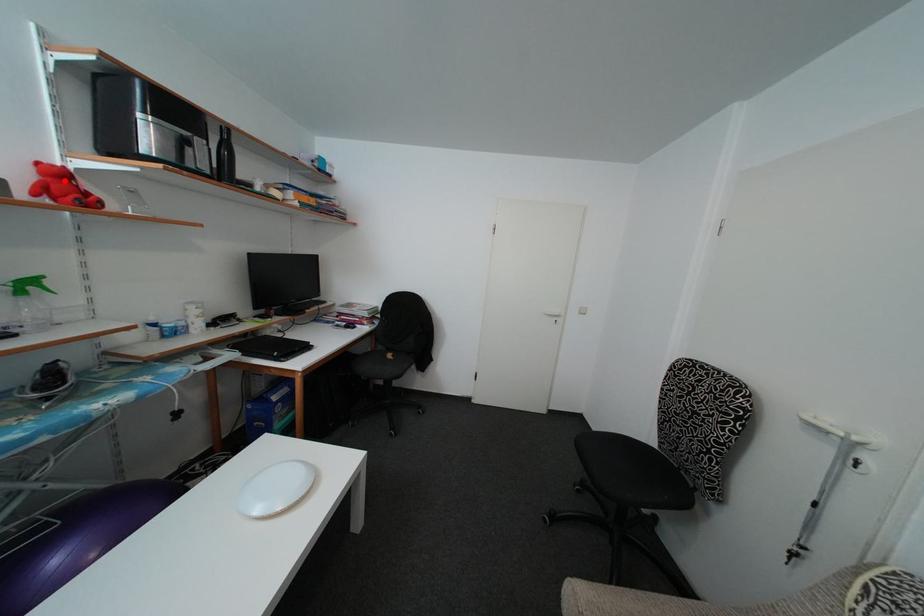
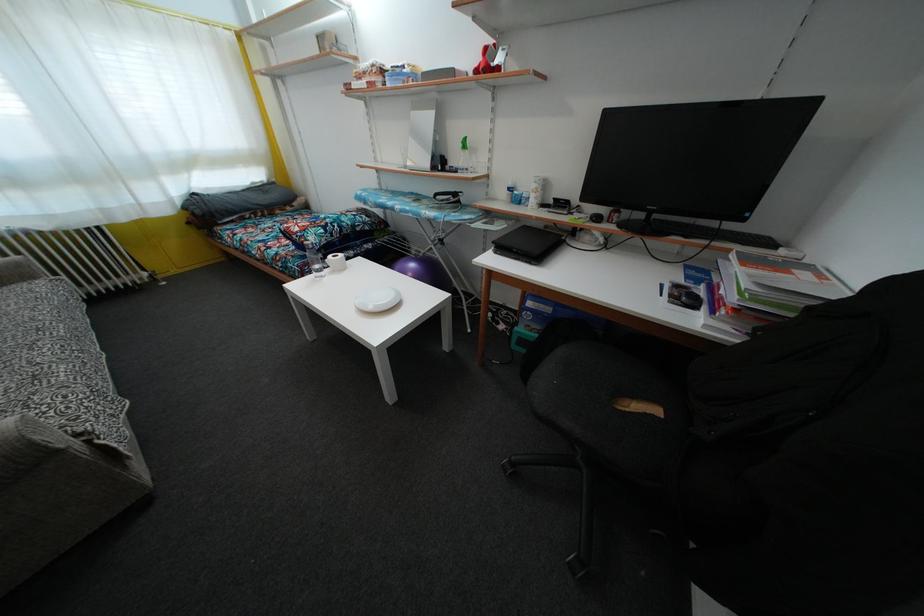
Question: A red point is marked in image1. In image2, is the corresponding 3D point closer to the camera or farther? Reply with the corresponding letter.

Choices:
 (A) The corresponding 3D point is closer.
 (B) The corresponding 3D point is farther.

Answer: (A)